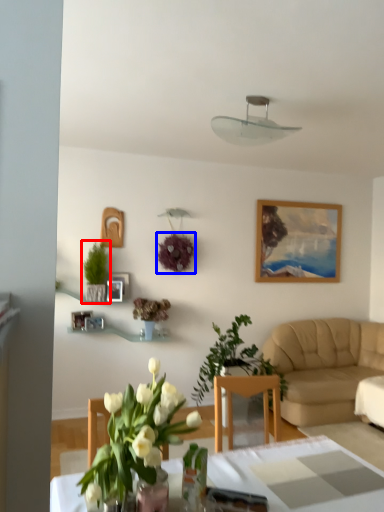
Question: Which point is closer to the camera, houseplant (highlighted by a red box) or flower (highlighted by a blue box)?

Choices:
 (A) houseplant
 (B) flower

Answer: (A)